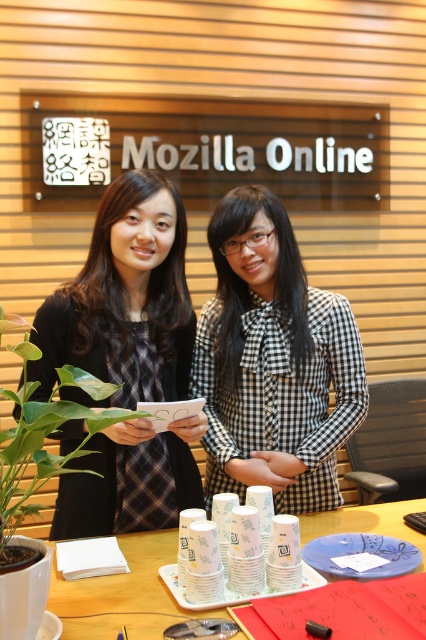
Question: Estimate the real-world distances between objects in this image. Which object is farther from the green leafy plant at left?

Choices:
 (A) black checkered blouse at center
 (B) matte black dress at center

Answer: (A)

Question: Which object appears farthest from the camera in this image?

Choices:
 (A) black checkered blouse at center
 (B) white paper cups at center
 (C) green leafy plant at left
 (D) matte black dress at center

Answer: (A)

Question: Estimate the real-world distances between objects in this image. Which object is closer to the green leafy plant at left?

Choices:
 (A) matte black dress at center
 (B) white paper cups at center
 (C) black checkered blouse at center

Answer: (A)

Question: Does black checkered blouse at center have a greater width compared to green leafy plant at left?

Choices:
 (A) no
 (B) yes

Answer: (A)

Question: From the image, what is the correct spatial relationship of black checkered blouse at center in relation to white paper cups at center?

Choices:
 (A) right
 (B) left

Answer: (A)

Question: Is the position of matte black dress at center more distant than that of green leafy plant at left?

Choices:
 (A) no
 (B) yes

Answer: (B)